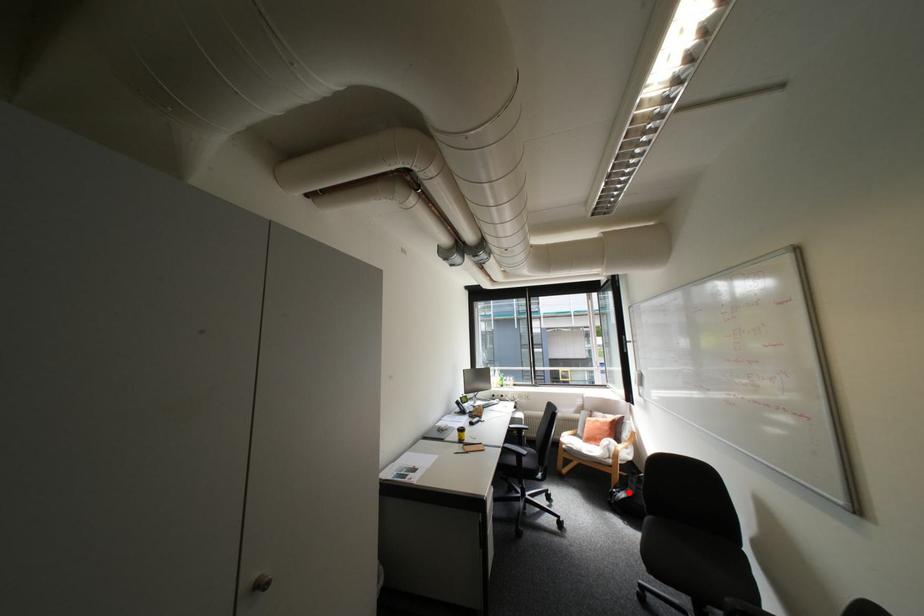
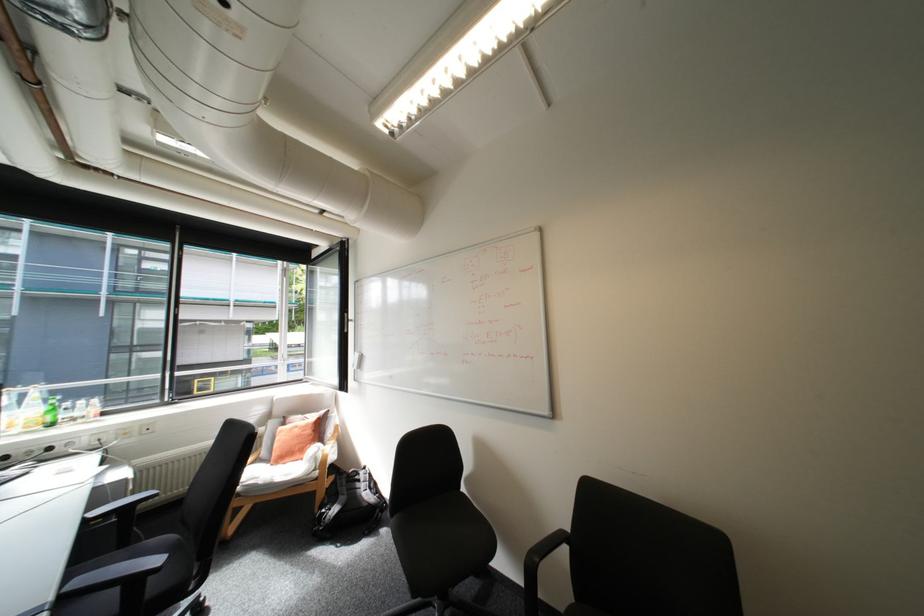
Question: I am providing you with two images of the same scene from different viewpoints. A red point is shown in image1. For the corresponding object point in image2, is it positioned nearer or farther from the camera?

Choices:
 (A) Nearer
 (B) Farther

Answer: (A)